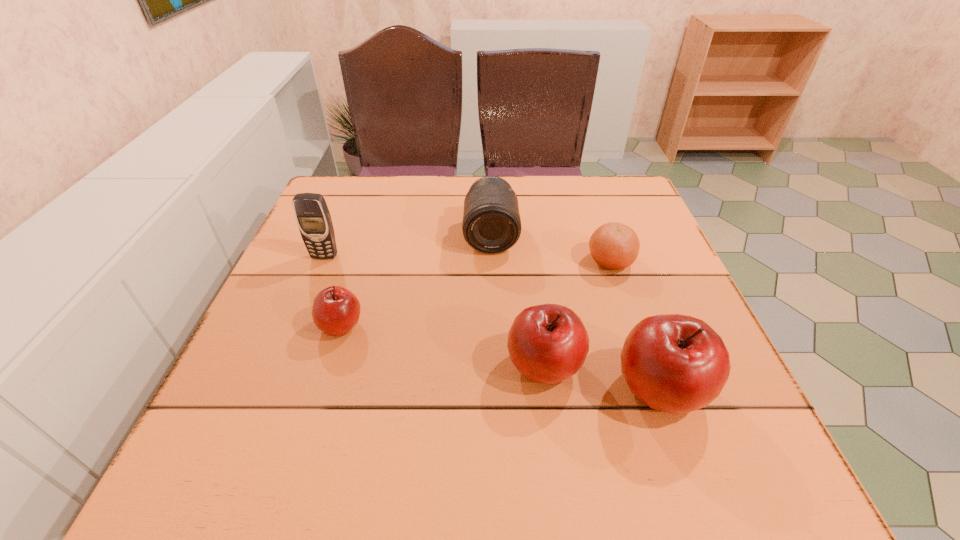
Locate an element on the screen. empty space that is in between the clementine and the second tallest apple is located at coordinates (577, 314).

At what (x,y) coordinates should I click in order to perform the action: click on empty location between the rightmost apple and the cellular telephone. Please return your answer as a coordinate pair (x, y). The height and width of the screenshot is (540, 960). Looking at the image, I should click on (492, 323).

Where is `free space between the clementine and the rightmost apple`? The height and width of the screenshot is (540, 960). free space between the clementine and the rightmost apple is located at coordinates (636, 326).

You are a GUI agent. You are given a task and a screenshot of the screen. Output one action in this format:
    pyautogui.click(x=<x>, y=<y>)
    Task: Click on the vacant space in between the telephoto lens and the rightmost apple
    
    Given the screenshot: What is the action you would take?
    pyautogui.click(x=576, y=313)

Where is `free point between the second tallest apple and the rightmost apple`? free point between the second tallest apple and the rightmost apple is located at coordinates (603, 378).

Find the location of `empty location between the shortest apple and the second apple from right to left`. empty location between the shortest apple and the second apple from right to left is located at coordinates (443, 346).

Locate an element on the screen. The width and height of the screenshot is (960, 540). object that can be found as the fourth closest to the clementine is located at coordinates (336, 310).

You are a GUI agent. You are given a task and a screenshot of the screen. Output one action in this format:
    pyautogui.click(x=<x>, y=<y>)
    Task: Click on the second closest object to the second apple from left to right
    
    Given the screenshot: What is the action you would take?
    pyautogui.click(x=615, y=246)

This screenshot has width=960, height=540. What are the coordinates of `the second closest apple to the second object from left to right` in the screenshot? It's located at (675, 363).

You are a GUI agent. You are given a task and a screenshot of the screen. Output one action in this format:
    pyautogui.click(x=<x>, y=<y>)
    Task: Click on the apple object that ranks as the second closest to the rightmost apple
    
    Given the screenshot: What is the action you would take?
    pyautogui.click(x=336, y=310)